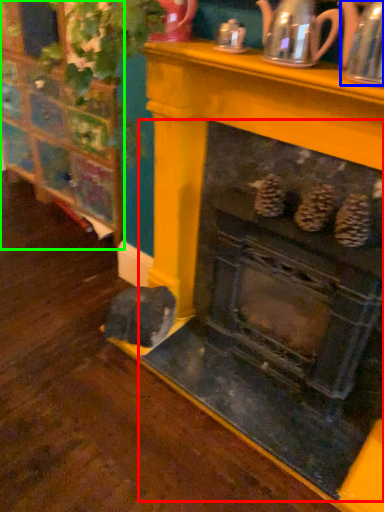
Question: Which object is positioned farthest from fireplace (highlighted by a red box)? Select from tea pot (highlighted by a blue box) and furniture (highlighted by a green box).

Choices:
 (A) tea pot
 (B) furniture

Answer: (B)